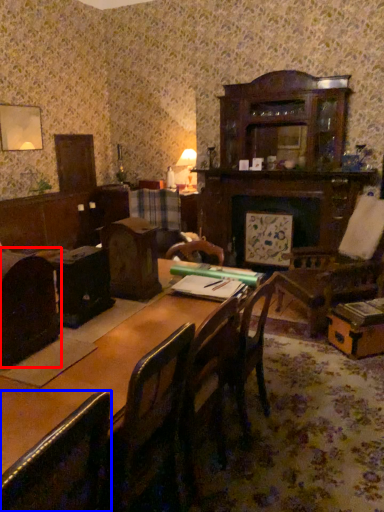
Question: Which point is closer to the camera, chair (highlighted by a red box) or chair (highlighted by a blue box)?

Choices:
 (A) chair
 (B) chair

Answer: (B)